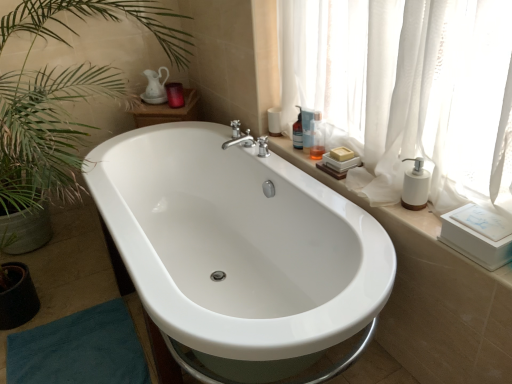
Locate an element on the screen. The height and width of the screenshot is (384, 512). free space above teal fabric bath mat at lower left (from a real-world perspective) is located at coordinates (68, 355).